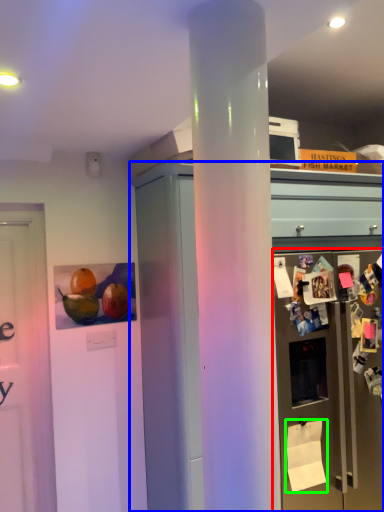
Question: Based on their relative distances, which object is farther from refrigerator (highlighted by a red box)? Choose from cabinetry (highlighted by a blue box) and toilet paper (highlighted by a green box).

Choices:
 (A) cabinetry
 (B) toilet paper

Answer: (B)